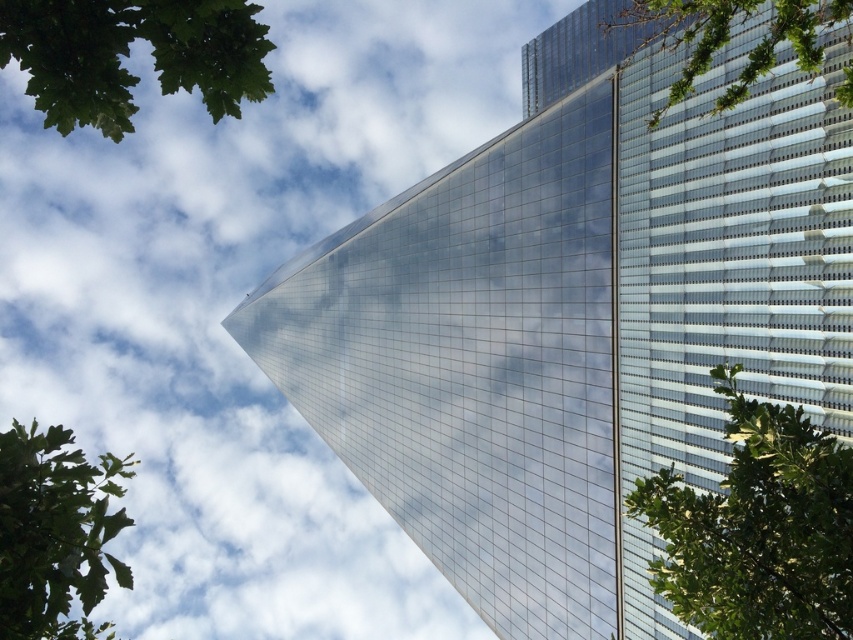
You are standing at the base of the skyscraper and want to take a photo of the triangular peak. The camera you have can only focus on objects within 7 meters. Is the point at coordinates point (155, 19) within the camera focus range?

The point at coordinates point (155, 19) is 7.70 meters away from the camera, which exceeds the camera focus range of 7 meters. Therefore, the camera cannot focus on that point.

You are standing in front of the modern skyscraper and notice two green leafy trees. Which one is closer to you, the green leafy tree at right or the green leafy tree at upper right?

The green leafy tree at right is closer to you because it appears smaller than the green leafy tree at upper right, which is further away.